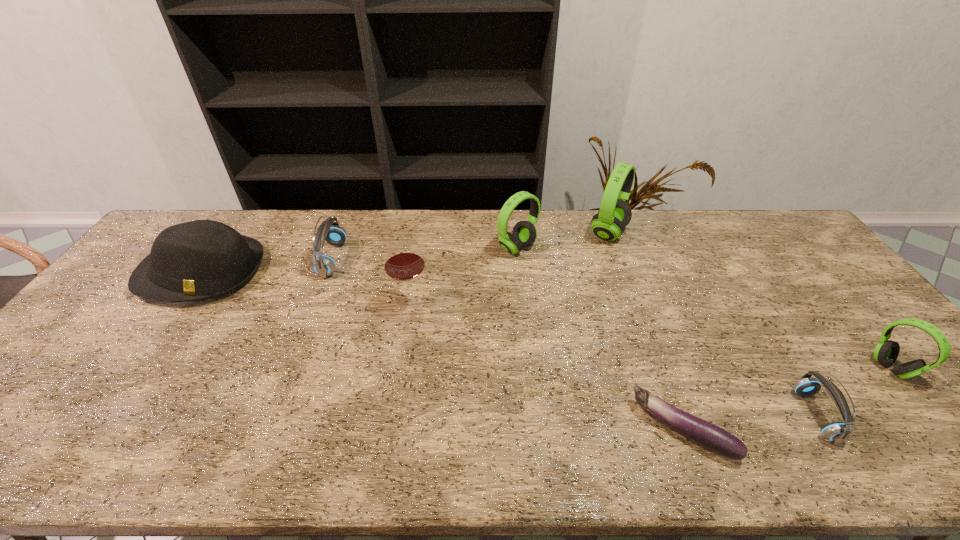
Identify the location of empty space that is in between the rightmost headset and the leftmost object. This screenshot has width=960, height=540. (547, 320).

This screenshot has height=540, width=960. What are the coordinates of `unoccupied area between the purple eggplant and the left blue headset` in the screenshot? It's located at (508, 345).

The height and width of the screenshot is (540, 960). I want to click on free area in between the red wineglass and the second smallest green headset, so click(464, 277).

What are the coordinates of `free space between the nearest green headset and the leftmost headset` in the screenshot? It's located at (612, 314).

At what (x,y) coordinates should I click in order to perform the action: click on blank region between the nearer blue headset and the fedora. Please return your answer as a coordinate pair (x, y). Looking at the image, I should click on (509, 344).

Find the location of a particular element. unoccupied position between the tallest headset and the leftmost headset is located at coordinates (470, 246).

Where is `the third closest object relative to the leftmost headset`? The image size is (960, 540). the third closest object relative to the leftmost headset is located at coordinates (524, 234).

Select which object appears as the sixth closest to the leftmost headset. Please provide its 2D coordinates. Your answer should be formatted as a tuple, i.e. [(x, y)], where the tuple contains the x and y coordinates of a point satisfying the conditions above.

[(837, 432)]

Identify the location of headset that is the fifth closest one to the fedora. This screenshot has height=540, width=960. (886, 352).

Identify the location of headset that is the third closest to the purple eggplant. (524, 234).